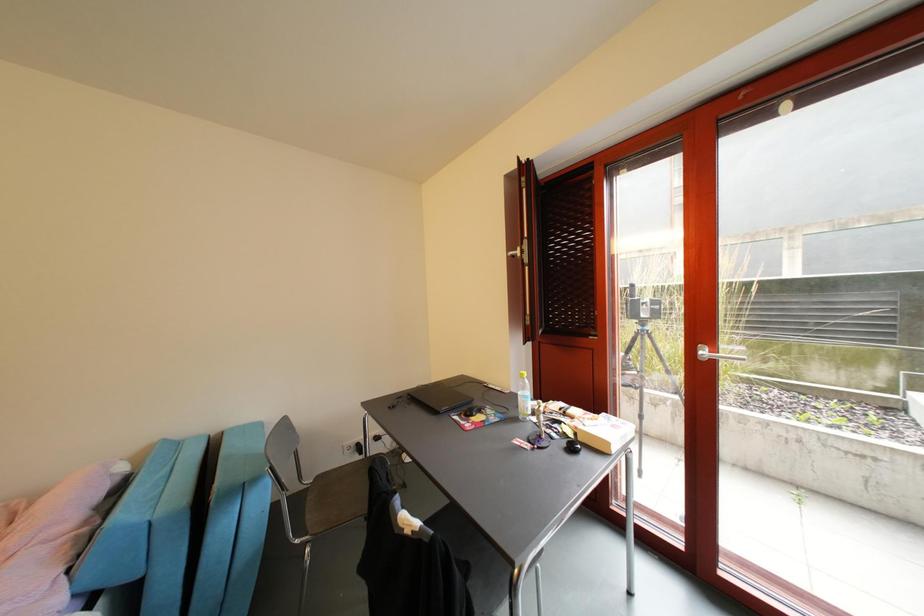
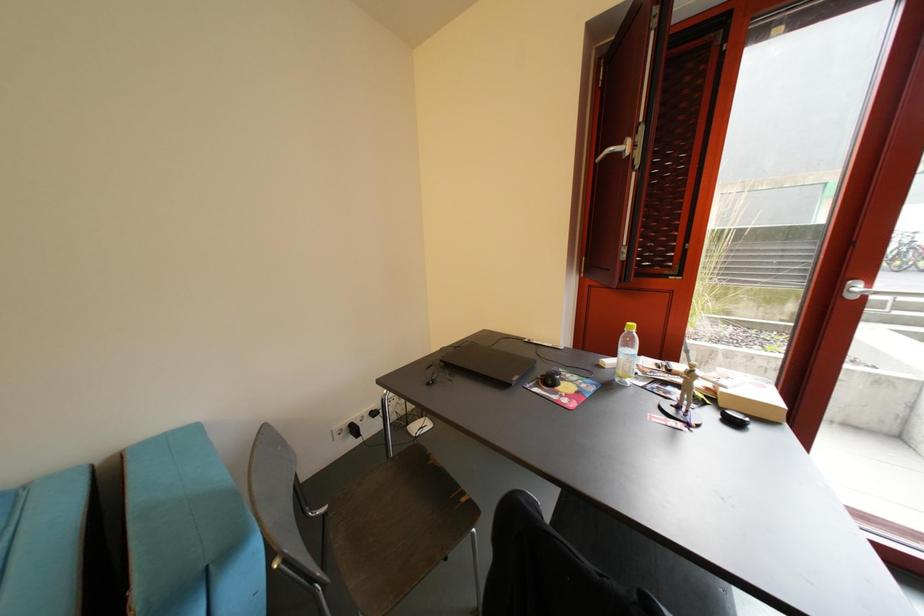
Question: The camera is either moving clockwise (left) or counter-clockwise (right) around the object. The first image is from the beginning of the video and the second image is from the end. Is the camera moving left or right when shooting the video?

Choices:
 (A) Left
 (B) Right

Answer: (A)